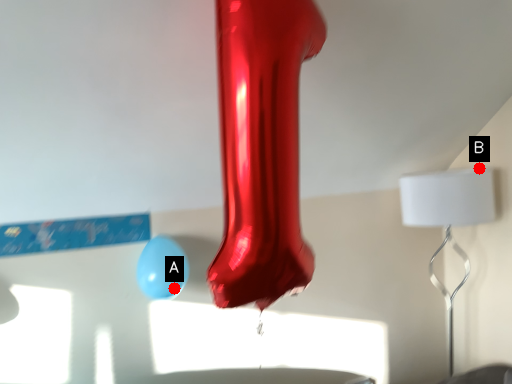
Question: Two points are circled on the image, labeled by A and B beside each circle. Which point is closer to the camera taking this photo?

Choices:
 (A) A is closer
 (B) B is closer

Answer: (A)